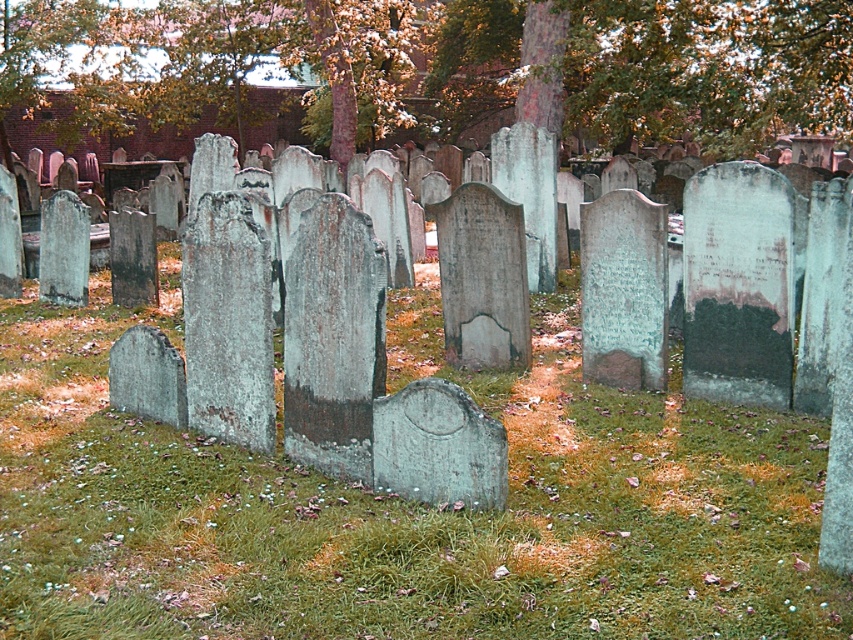
Can you confirm if green mossy grass at center is positioned to the left of green leafy tree at center?

Indeed, green mossy grass at center is positioned on the left side of green leafy tree at center.

Is point (316, 598) more distant than point (648, 88)?

No, it is in front of (648, 88).

Find the location of a particular element. The image size is (853, 640). green mossy grass at center is located at coordinates (401, 504).